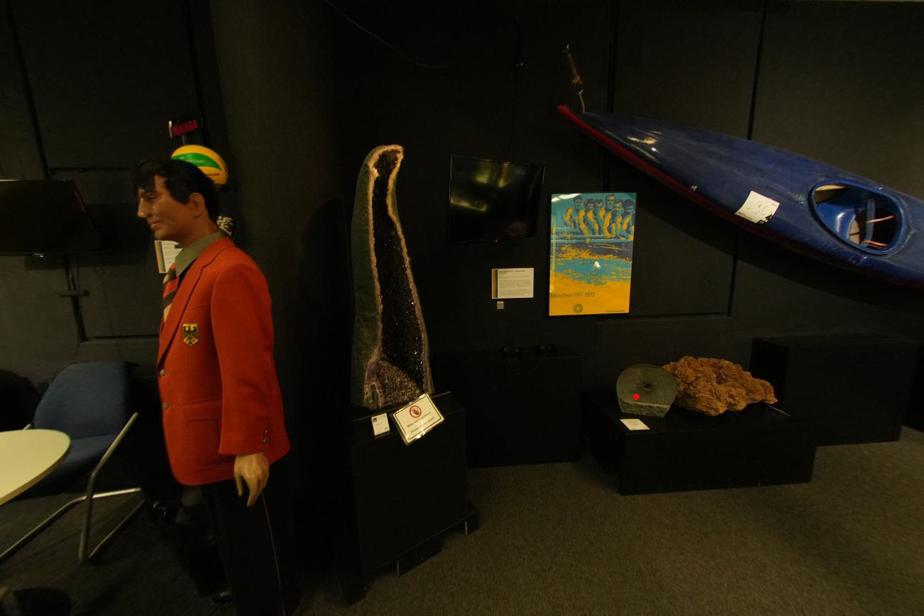
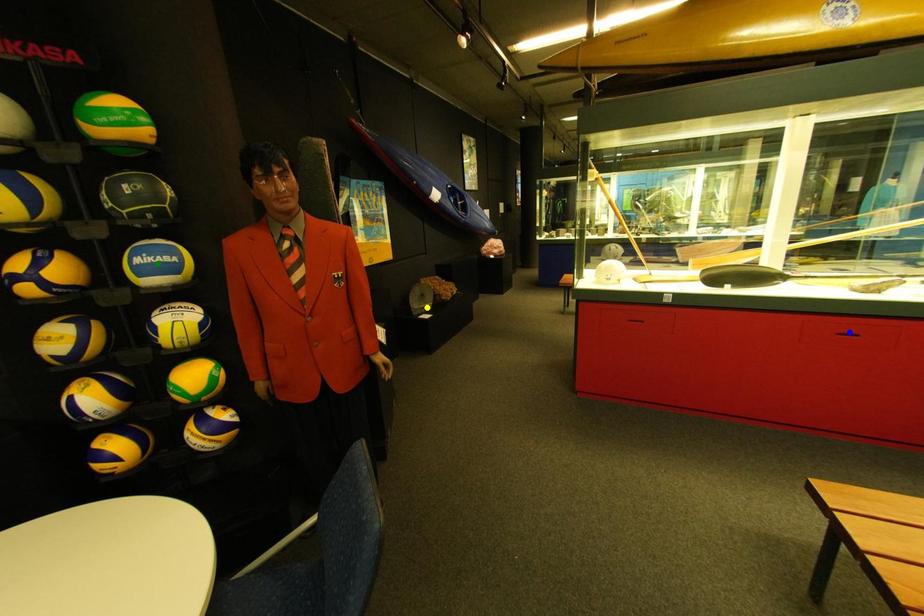
Question: I am providing you with two images of the same scene from different viewpoints. A red point is marked on the first image. You are given multiple points on the second image. Which spot in image 2 lines up with the point in image 1?

Choices:
 (A) blue point
 (B) green point
 (C) yellow point

Answer: (C)